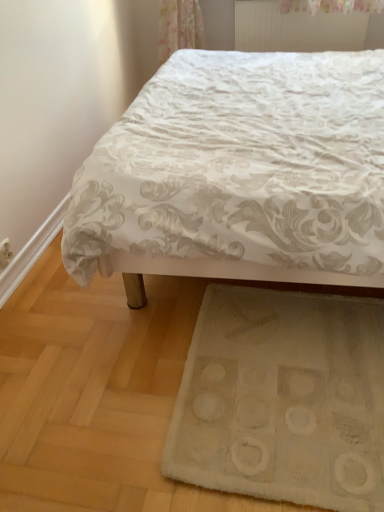
Locate an element on the screen. white textured bed at center is located at coordinates (240, 172).

Does point (212, 98) lie behind point (353, 342)?

Yes, point (212, 98) is behind point (353, 342).

Could you tell me if white textured bed at center is facing white soft rug at lower center?

No, white textured bed at center is not oriented towards white soft rug at lower center.

Between white textured bed at center and white soft rug at lower center, which one has more height?

With more height is white textured bed at center.

Which of these two, white soft rug at lower center or white textured radiator at upper center, is bigger?

With larger size is white soft rug at lower center.

Considering the sizes of objects white soft rug at lower center and white textured radiator at upper center in the image provided, who is taller, white soft rug at lower center or white textured radiator at upper center?

white textured radiator at upper center.

How many degrees apart are the facing directions of white soft rug at lower center and white textured radiator at upper center?

The angular difference between white soft rug at lower center and white textured radiator at upper center is 2.13 degrees.

In the image, there is a white soft rug at lower center. Where is `radiator above it (from the image's perspective)`? radiator above it (from the image's perspective) is located at coordinates (296, 29).

Is white textured bed at center not near white textured radiator at upper center?

That's right, there is a large distance between white textured bed at center and white textured radiator at upper center.

From their relative heights in the image, would you say white textured bed at center is taller or shorter than white textured radiator at upper center?

In the image, white textured bed at center appears to be taller than white textured radiator at upper center.

Measure the distance from white textured radiator at upper center to white textured bed at center.

white textured radiator at upper center and white textured bed at center are 1.34 meters apart from each other.

From their relative heights in the image, would you say white textured radiator at upper center is taller or shorter than white textured bed at center?

white textured radiator at upper center is shorter than white textured bed at center.

From the image's perspective, is white textured radiator at upper center above white textured bed at center?

Correct, white textured radiator at upper center appears higher than white textured bed at center in the image.

Looking at this image, considering the sizes of objects white textured radiator at upper center and white textured bed at center in the image provided, who is thinner, white textured radiator at upper center or white textured bed at center?

white textured radiator at upper center is thinner.

Consider the image. Which is behind, white soft rug at lower center or white textured bed at center?

Positioned behind is white soft rug at lower center.

Is white soft rug at lower center touching white textured bed at center?

No, white soft rug at lower center is not next to white textured bed at center.

Which object is positioned more to the right, white soft rug at lower center or white textured bed at center?

white textured bed at center.

Looking at this image, from their relative heights in the image, would you say white textured radiator at upper center is taller or shorter than white soft rug at lower center?

Considering their sizes, white textured radiator at upper center has more height than white soft rug at lower center.

Is there a large distance between white textured radiator at upper center and white soft rug at lower center?

That's right, there is a large distance between white textured radiator at upper center and white soft rug at lower center.

Between point (268, 12) and point (334, 386), which one is positioned behind?

The point (268, 12) is farther from the camera.

Is white soft rug at lower center completely or partially inside white textured radiator at upper center?

No, white textured radiator at upper center does not contain white soft rug at lower center.

I want to click on doormat on the left side of white textured bed at center, so [x=283, y=399].

This screenshot has width=384, height=512. Identify the location of radiator to the right of white soft rug at lower center. (296, 29).

Which object lies further to the anchor point white textured radiator at upper center, white textured bed at center or white soft rug at lower center?

Based on the image, white soft rug at lower center appears to be further to white textured radiator at upper center.

Based on the photo, from the image, which object appears to be farther from white textured radiator at upper center, white soft rug at lower center or white textured bed at center?

Based on the image, white soft rug at lower center appears to be further to white textured radiator at upper center.

In the scene shown: Estimate the real-world distances between objects in this image. Which object is closer to white soft rug at lower center, white textured radiator at upper center or white textured bed at center?

white textured bed at center lies closer to white soft rug at lower center than the other object.

Based on their spatial positions, is white textured radiator at upper center or white soft rug at lower center further from white textured bed at center?

Based on the image, white textured radiator at upper center appears to be further to white textured bed at center.

Estimate the real-world distances between objects in this image. Which object is further from white textured bed at center, white soft rug at lower center or white textured radiator at upper center?

Based on the image, white textured radiator at upper center appears to be further to white textured bed at center.

Based on their spatial positions, is white textured bed at center or white textured radiator at upper center further from white soft rug at lower center?

Based on the image, white textured radiator at upper center appears to be further to white soft rug at lower center.

Locate an element on the screen. The image size is (384, 512). doormat between white textured bed at center and white textured radiator at upper center in the front-back direction is located at coordinates (283, 399).